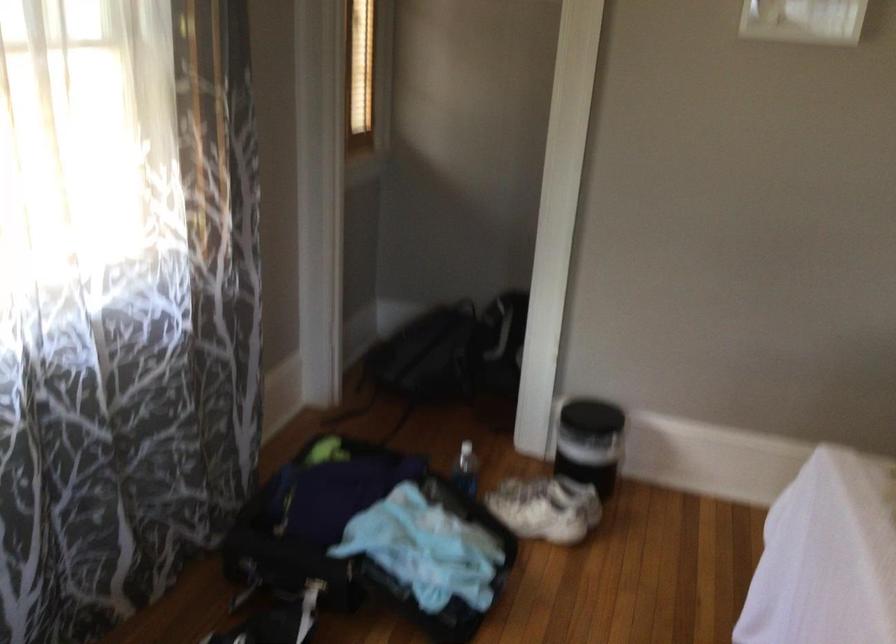
Describe the element at coordinates (582, 420) in the screenshot. This screenshot has width=896, height=644. I see `the black trash can lid` at that location.